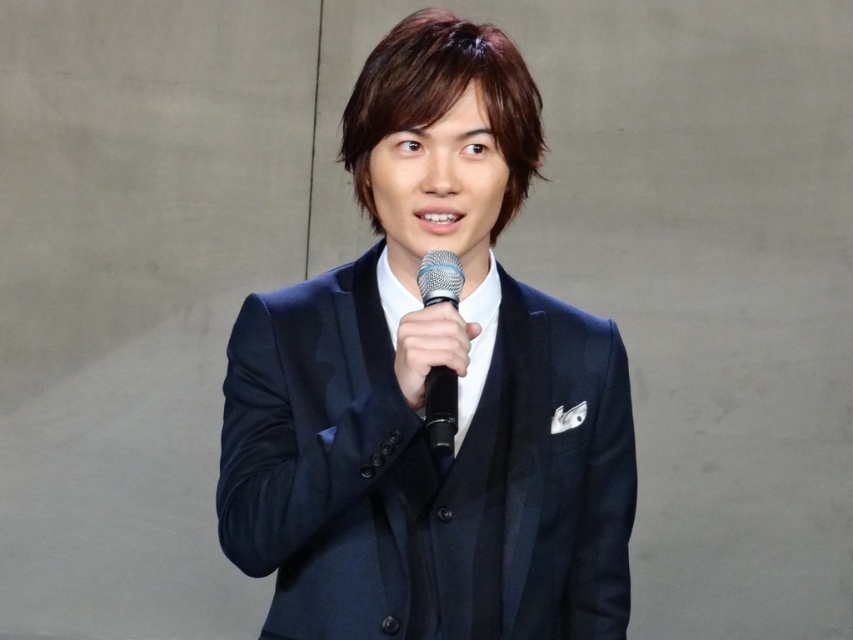
You are standing in a room and see the point marked at coordinates point [579,413]. If you take a step forward, will the point become closer to you?

The point [579,413] is 1.75 meters away from viewer. Taking a step forward would decrease the distance between you and the point, so yes, it will become closer.

You are a photographer adjusting the camera focus. You have two points in your viewfinder labeled as point (306, 634) and point (428, 449). Which point should you focus on first if you want to capture the subject from front to back?

You should focus on point (428, 449) first because point (306, 634) is behind it, ensuring the foreground is sharp before moving to the background.